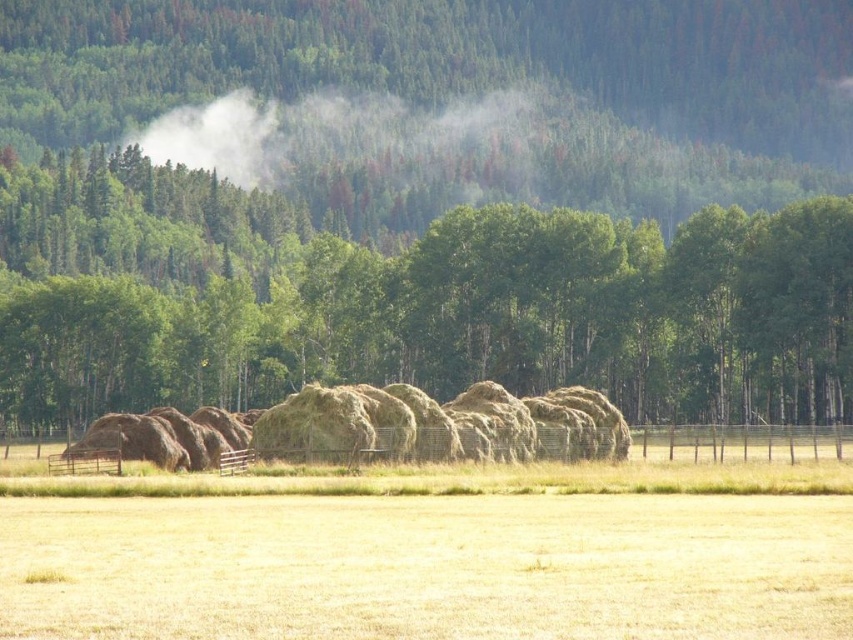
You are a farmer checking the weather conditions. You see the dry grass at center and the white foggy cloud at upper center. Which object has a smaller width?

The dry grass at center has a smaller width than the white foggy cloud at upper center according to the description.

You are standing at the point marked by the coordinates point (410, 301) in the image. What is the closest object to you in the scene?

The point (410, 301) indicates green leafy tree at center, so the closest object to you is the green leafy tree at center.